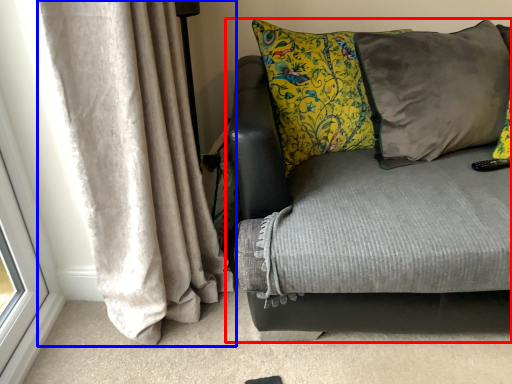
Question: Among these objects, which one is nearest to the camera, studio couch (highlighted by a red box) or curtain (highlighted by a blue box)?

Choices:
 (A) studio couch
 (B) curtain

Answer: (B)